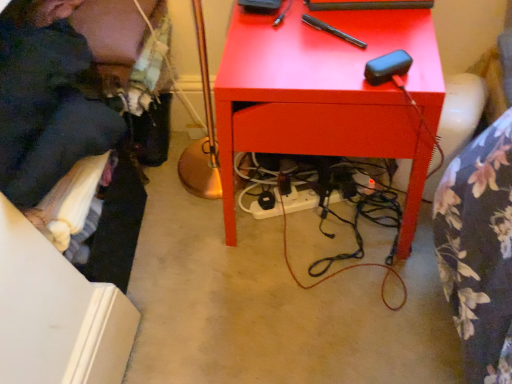
This screenshot has height=384, width=512. I want to click on free space that is to the left of matte red desk at center, so click(194, 269).